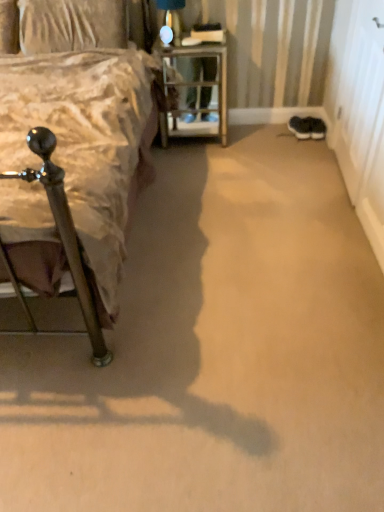
Question: Considering the relative sizes of metal/textured nightstand at center and white wood screen door at right in the image provided, is metal/textured nightstand at center taller than white wood screen door at right?

Choices:
 (A) no
 (B) yes

Answer: (A)

Question: Is metal/textured nightstand at center wider than white wood screen door at right?

Choices:
 (A) no
 (B) yes

Answer: (B)

Question: Does metal/textured nightstand at center have a lesser height compared to white wood screen door at right?

Choices:
 (A) no
 (B) yes

Answer: (B)

Question: Is metal/textured nightstand at center completely or partially outside of white wood screen door at right?

Choices:
 (A) no
 (B) yes

Answer: (B)

Question: Considering the relative positions of metal/textured nightstand at center and white wood screen door at right in the image provided, is metal/textured nightstand at center to the left of white wood screen door at right from the viewer's perspective?

Choices:
 (A) no
 (B) yes

Answer: (B)

Question: Is metal/textured nightstand at center at the right side of white wood screen door at right?

Choices:
 (A) no
 (B) yes

Answer: (A)

Question: Is white wood screen door at right facing towards metallic silver bed at left?

Choices:
 (A) yes
 (B) no

Answer: (A)

Question: Is white wood screen door at right in contact with metallic silver bed at left?

Choices:
 (A) yes
 (B) no

Answer: (B)

Question: Is white wood screen door at right bigger than metallic silver bed at left?

Choices:
 (A) no
 (B) yes

Answer: (A)

Question: From a real-world perspective, is white wood screen door at right under metallic silver bed at left?

Choices:
 (A) no
 (B) yes

Answer: (B)

Question: From the image's perspective, would you say white wood screen door at right is positioned over metallic silver bed at left?

Choices:
 (A) no
 (B) yes

Answer: (B)

Question: Is white wood screen door at right positioned in front of metallic silver bed at left?

Choices:
 (A) yes
 (B) no

Answer: (B)

Question: From the image's perspective, is black suede sneakers at lower right, marked as the first footwear in a right-to-left arrangement, on top of metallic silver bed at left?

Choices:
 (A) yes
 (B) no

Answer: (A)